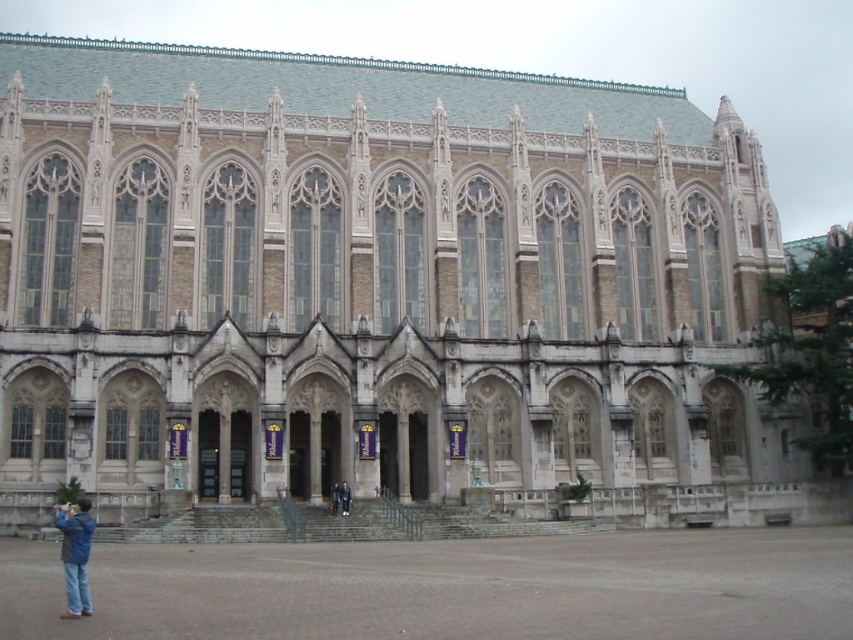
You are standing in front of the historic building and see a blue denim jacket at lower left and dark blue jeans at lower center. Which item is nearer to you?

The blue denim jacket at lower left is closer to the viewer than the dark blue jeans at lower center.